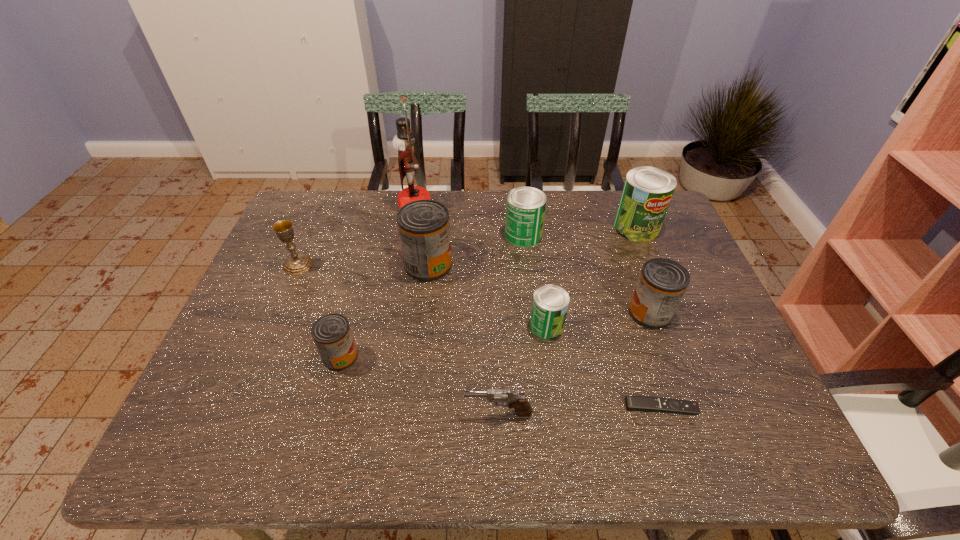
The image size is (960, 540). Find the location of `the second object from left to right`. the second object from left to right is located at coordinates (332, 335).

Where is `the third nearest object`? the third nearest object is located at coordinates click(x=332, y=335).

Locate an element on the screen. This screenshot has height=540, width=960. the smallest green can is located at coordinates (550, 304).

Image resolution: width=960 pixels, height=540 pixels. I want to click on the ninth tallest object, so click(x=522, y=407).

You are a GUI agent. You are given a task and a screenshot of the screen. Output one action in this format:
    pyautogui.click(x=<x>, y=<y>)
    Task: Click on the gray pistol
    Image resolution: width=960 pixels, height=540 pixels.
    Given the screenshot: What is the action you would take?
    tap(522, 407)

The width and height of the screenshot is (960, 540). I want to click on remote control, so click(633, 403).

Where is `free space located 0.220m on the front-facing side of the tallest object`? The height and width of the screenshot is (540, 960). free space located 0.220m on the front-facing side of the tallest object is located at coordinates (497, 206).

At what (x,y) coordinates should I click in order to perform the action: click on free space located on the right of the third farthest can. Please return your answer as a coordinate pair (x, y). This screenshot has width=960, height=540. Looking at the image, I should click on (517, 265).

Where is `vacant area situated 0.110m on the left of the rightmost green can`? vacant area situated 0.110m on the left of the rightmost green can is located at coordinates tap(580, 227).

This screenshot has width=960, height=540. I want to click on free location located 0.160m on the right of the chalice, so click(368, 265).